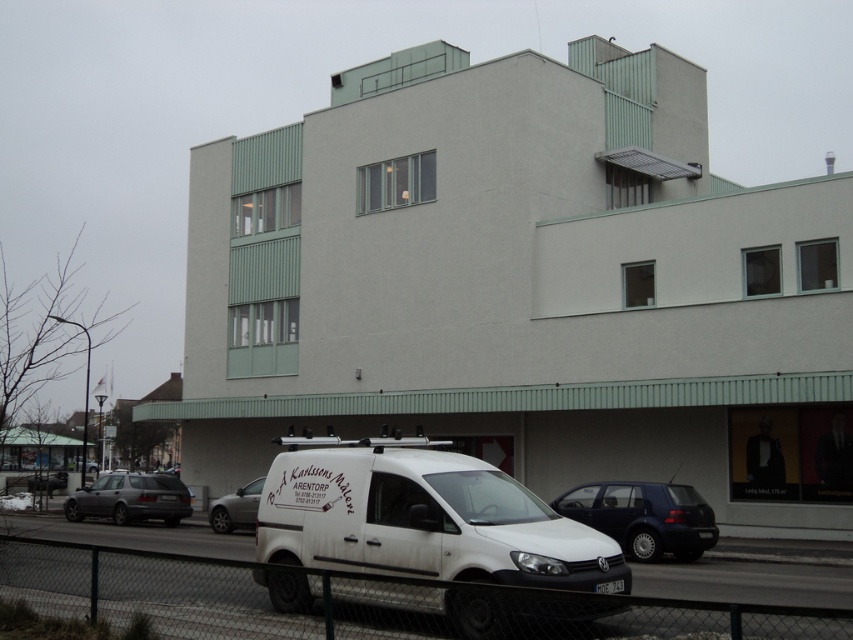
Question: Does white matte van at lower center have a larger size compared to metallic chain-link fence at lower center?

Choices:
 (A) yes
 (B) no

Answer: (B)

Question: In this image, where is metallic chain-link fence at lower center located relative to matte gray station wagon at lower left?

Choices:
 (A) left
 (B) right

Answer: (B)

Question: Is metallic chain-link fence at lower center below dark blue matte car at center?

Choices:
 (A) no
 (B) yes

Answer: (A)

Question: Among these points, which one is farthest from the camera?

Choices:
 (A) (585, 497)
 (B) (50, 577)
 (C) (253, 500)

Answer: (C)

Question: Which of the following is the farthest from the observer?

Choices:
 (A) silver metallic car at center
 (B) dark blue matte car at center

Answer: (A)

Question: Based on their relative distances, which object is farther from the dark blue matte car at center?

Choices:
 (A) matte gray station wagon at lower left
 (B) white matte van at lower center

Answer: (A)